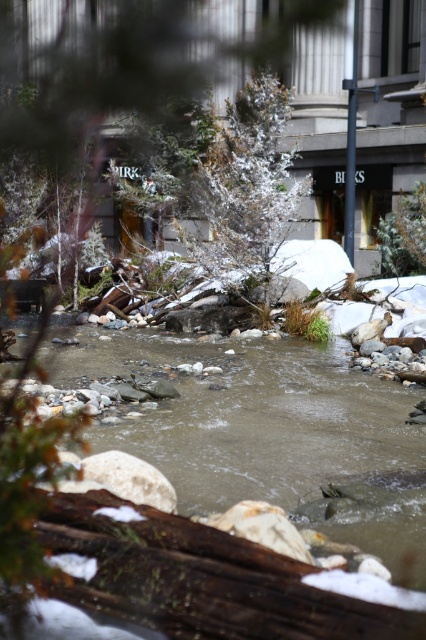
Question: Which point is closer to the camera taking this photo?

Choices:
 (A) (259, 596)
 (B) (221, 490)

Answer: (A)

Question: Which point appears farthest from the camera in this image?

Choices:
 (A) (264, 618)
 (B) (245, 154)
 (C) (164, 440)

Answer: (B)

Question: Which of the following is the closest to the observer?

Choices:
 (A) (348, 470)
 (B) (224, 596)
 (C) (227, 177)
 (D) (157, 6)

Answer: (B)

Question: Is smooth rock stream at center to the left of brown rough log at lower center from the viewer's perspective?

Choices:
 (A) yes
 (B) no

Answer: (A)

Question: Is smooth rock stream at center bigger than snow-covered evergreen at center?

Choices:
 (A) yes
 (B) no

Answer: (A)

Question: Does snow-covered evergreen tree at center appear over snow-covered evergreen at center?

Choices:
 (A) no
 (B) yes

Answer: (B)